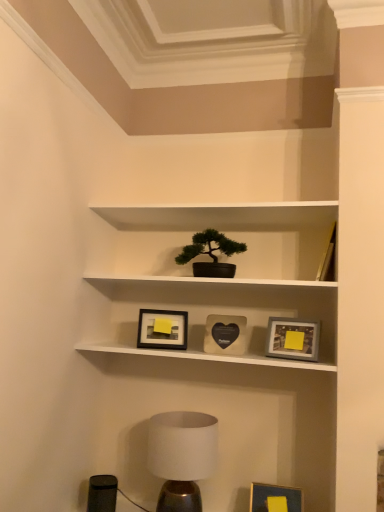
Question: From a real-world perspective, is matte blue picture frame at lower right, the second picture frame viewed from the right, physically located above or below matte black heart-shaped picture frame at center, which is the 4th picture frame from bottom to top?

Choices:
 (A) below
 (B) above

Answer: (A)

Question: Relative to matte black heart-shaped picture frame at center, which is counted as the second picture frame, starting from the left, is matte blue picture frame at lower right, the second picture frame viewed from the right, in front or behind?

Choices:
 (A) front
 (B) behind

Answer: (A)

Question: Estimate the real-world distances between objects in this image. Which object is closer to the matte blue picture frame at lower right, which ranks as the 3th picture frame in left-to-right order?

Choices:
 (A) matte gray picture frame at center right, the 1th picture frame positioned from the right
 (B) green matte houseplant at upper center
 (C) white matte shelf at center
 (D) matte black picture frame at center, acting as the 4th picture frame starting from the right
 (E) white matte table lamp at lower center

Answer: (E)

Question: Which object is the closest to the matte black heart-shaped picture frame at center, the first picture frame viewed from the top?

Choices:
 (A) matte black picture frame at center, which ranks as the 3th picture frame in bottom-to-top order
 (B) matte gray picture frame at center right, placed as the 4th picture frame when sorted from left to right
 (C) matte blue picture frame at lower right, the second picture frame viewed from the right
 (D) white matte table lamp at lower center
 (E) green matte houseplant at upper center

Answer: (A)